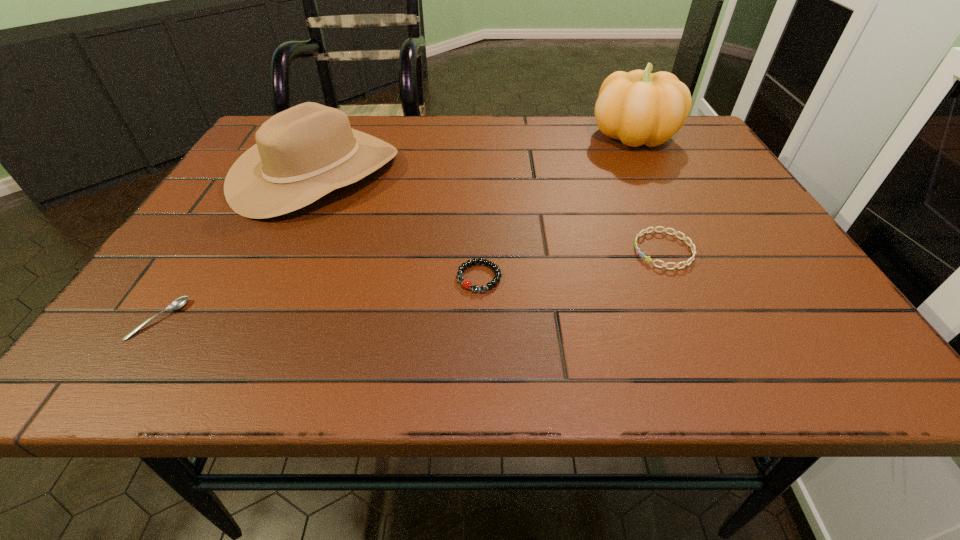
In order to click on object located in the far left corner section of the desktop in this screenshot , I will do `click(303, 153)`.

This screenshot has width=960, height=540. I want to click on object present at the near left corner, so click(x=180, y=302).

Identify the location of object that is at the far right corner. (639, 107).

In the image, there is a desktop. Where is `blank space at the far edge`? The height and width of the screenshot is (540, 960). blank space at the far edge is located at coordinates (456, 137).

Identify the location of vacant position at the near edge of the desktop. (246, 372).

The width and height of the screenshot is (960, 540). Find the location of `blank space at the far right corner of the desktop`. blank space at the far right corner of the desktop is located at coordinates [x=657, y=148].

You are a GUI agent. You are given a task and a screenshot of the screen. Output one action in this format:
    pyautogui.click(x=<x>, y=<y>)
    Task: Click on the vacant space at the near right corner
    This screenshot has height=540, width=960.
    Given the screenshot: What is the action you would take?
    pyautogui.click(x=756, y=348)

Where is `free space that is in between the right bracelet and the nearest object`? free space that is in between the right bracelet and the nearest object is located at coordinates (411, 285).

Find the location of a particular element. Image resolution: width=960 pixels, height=540 pixels. free spot between the third object from left to right and the tallest object is located at coordinates (556, 206).

Where is `unoccupied position between the right bracelet and the fourth tallest object`? The image size is (960, 540). unoccupied position between the right bracelet and the fourth tallest object is located at coordinates (571, 264).